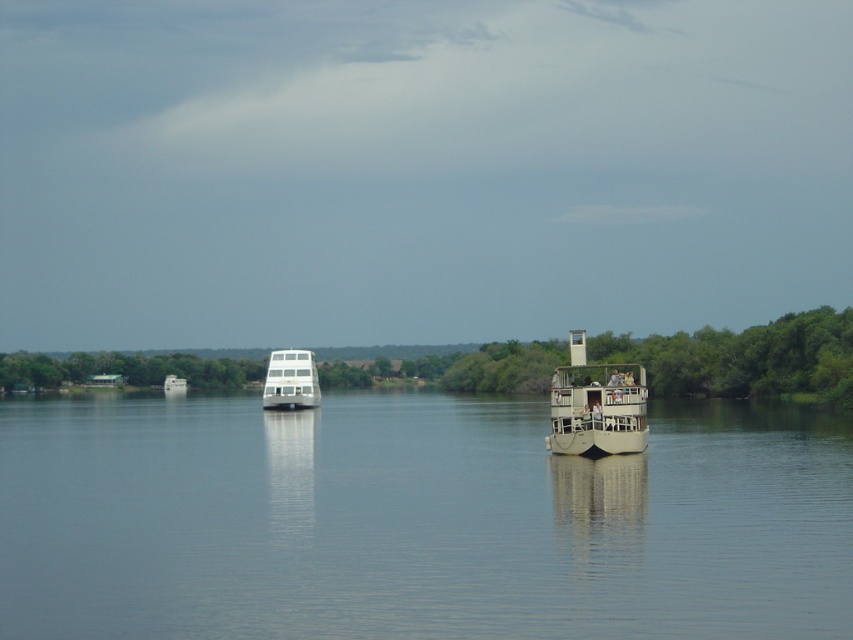
You are standing on the dock and want to board the beige wooden boat at center and the white glossy boat at center. Which one is farther from the other boat?

The distance between the beige wooden boat at center and the white glossy boat at center is 176.25 feet, so they are both equally distant from each other.

You are a photographer trying to capture the reflection of the larger boat with multiple decks on the smooth water at center. Based on the scene description, where should you position your camera to ensure the reflection is fully visible in the photo?

The smooth water at center is located at point (416, 520), so you should position your camera directly above or facing that coordinate to capture the reflection of the larger boat with multiple decks.